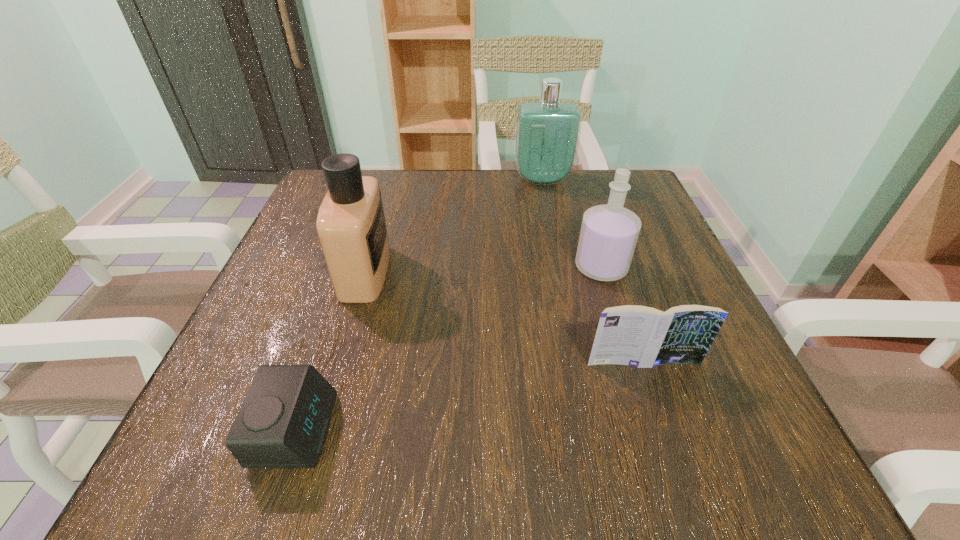
This screenshot has height=540, width=960. Find the location of `perfume that is the closest to the fourth tallest object`. perfume that is the closest to the fourth tallest object is located at coordinates (609, 232).

Where is `free region that satisfies the following two spatial constraints: 1. on the front label of the farthest object; 2. on the front-facing side of the nearest object`? The width and height of the screenshot is (960, 540). free region that satisfies the following two spatial constraints: 1. on the front label of the farthest object; 2. on the front-facing side of the nearest object is located at coordinates (594, 430).

Image resolution: width=960 pixels, height=540 pixels. Identify the location of vacant space that satisfies the following two spatial constraints: 1. on the front label of the farthest object; 2. on the front-facing side of the alarm clock. (594, 430).

Find the location of `vacant point that satisfies the following two spatial constraints: 1. on the front label of the farthest object; 2. on the front-facing side of the nearest object`. vacant point that satisfies the following two spatial constraints: 1. on the front label of the farthest object; 2. on the front-facing side of the nearest object is located at coordinates (594, 430).

This screenshot has width=960, height=540. I want to click on blank area in the image that satisfies the following two spatial constraints: 1. on the front label of the farthest perfume; 2. on the front-facing side of the alarm clock, so click(594, 430).

This screenshot has width=960, height=540. I want to click on blank space that satisfies the following two spatial constraints: 1. on the front cover of the second shortest object; 2. on the front-facing side of the alarm clock, so click(666, 430).

Image resolution: width=960 pixels, height=540 pixels. Find the location of `free space that satisfies the following two spatial constraints: 1. on the front label of the farthest object; 2. on the front-facing side of the alarm clock`. free space that satisfies the following two spatial constraints: 1. on the front label of the farthest object; 2. on the front-facing side of the alarm clock is located at coordinates (594, 430).